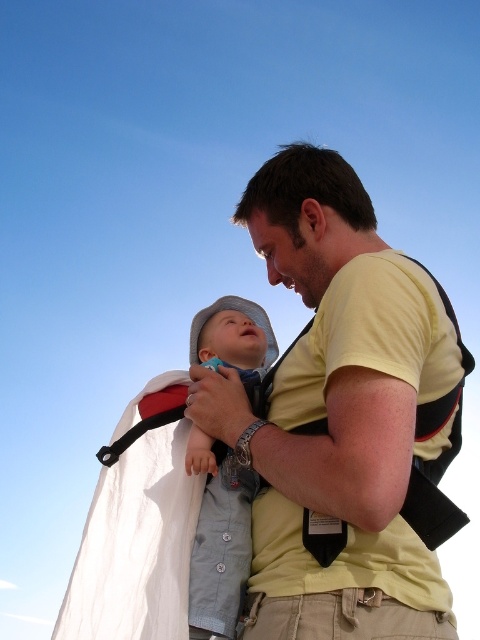
You are a photographer trying to capture a closeup of the yellow cotton shirt at center and the light blue denim shirt at center. Since the camera can only focus on one subject at a time, which shirt should you focus on to ensure the other is still visible in the background?

The yellow cotton shirt at center is in front of the light blue denim shirt at center, so you should focus on the yellow cotton shirt at center to keep the light blue denim shirt at center visible in the background.